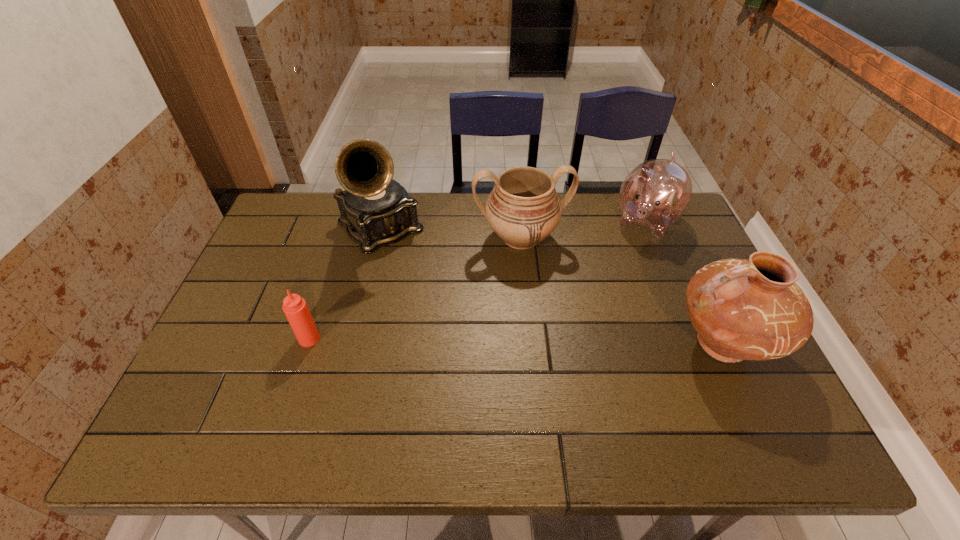
At what (x,y) coordinates should I click in order to perform the action: click on free space between the pottery and the third object from right to left. Please return your answer as a coordinate pair (x, y). This screenshot has width=960, height=540. Looking at the image, I should click on (621, 291).

Identify the location of empty space between the tallest object and the shortest object. (345, 284).

At what (x,y) coordinates should I click in order to perform the action: click on empty location between the Tabasco sauce and the urn. Please return your answer as a coordinate pair (x, y). Looking at the image, I should click on (415, 288).

Identify the location of unoccupied position between the shortest object and the piggy bank. The image size is (960, 540). 478,280.

Where is `free spot between the pottery and the phonograph record`? This screenshot has height=540, width=960. free spot between the pottery and the phonograph record is located at coordinates (551, 286).

The height and width of the screenshot is (540, 960). Find the location of `empty location between the third object from left to right and the phonograph record`. empty location between the third object from left to right and the phonograph record is located at coordinates (450, 233).

Where is `free spot between the phonograph record and the shortest object`? Image resolution: width=960 pixels, height=540 pixels. free spot between the phonograph record and the shortest object is located at coordinates point(345,284).

You are a GUI agent. You are given a task and a screenshot of the screen. Output one action in this format:
    pyautogui.click(x=<x>, y=<y>)
    Task: Click on the unoccupied position between the third object from right to left and the phonograph record
    The width and height of the screenshot is (960, 540).
    Given the screenshot: What is the action you would take?
    (450, 233)

This screenshot has width=960, height=540. Find the location of `free point between the third object from right to left and the tallest object`. free point between the third object from right to left and the tallest object is located at coordinates (450, 233).

Locate an element on the screen. Image resolution: width=960 pixels, height=540 pixels. object that is the fourth closest to the tallest object is located at coordinates (742, 309).